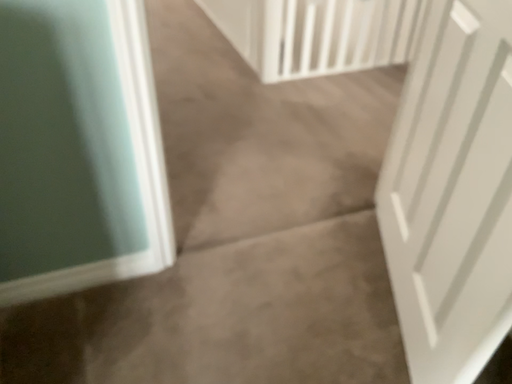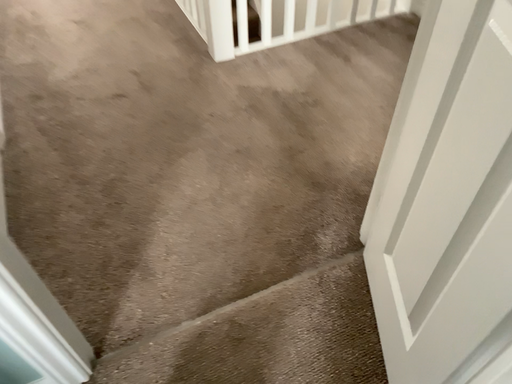
Question: How did the camera likely rotate when shooting the video?

Choices:
 (A) rotated downward
 (B) rotated upward

Answer: (A)